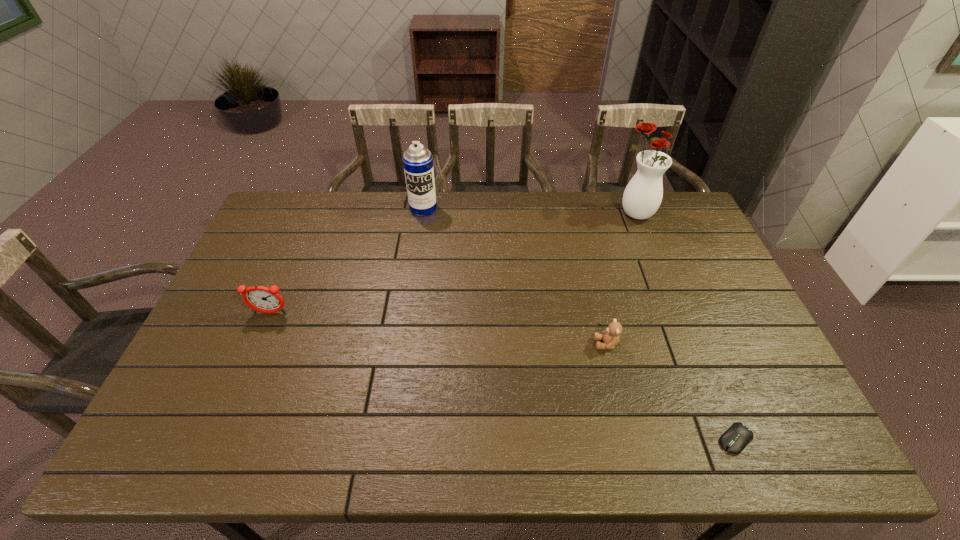
At what (x,y) coordinates should I click in order to perform the action: click on vacant space located on the label side of the fourth shortest object. Please return your answer as a coordinate pair (x, y). This screenshot has height=540, width=960. Looking at the image, I should click on (410, 299).

Where is `vacant space located 0.390m on the front-facing side of the leftmost object`? This screenshot has width=960, height=540. vacant space located 0.390m on the front-facing side of the leftmost object is located at coordinates (211, 452).

Where is `blank space located on the front-facing side of the teddy bear`? The height and width of the screenshot is (540, 960). blank space located on the front-facing side of the teddy bear is located at coordinates (458, 344).

Locate an element on the screen. free space located on the front-facing side of the teddy bear is located at coordinates (562, 344).

Locate an element on the screen. Image resolution: width=960 pixels, height=540 pixels. vacant space located 0.300m on the front-facing side of the teddy bear is located at coordinates (484, 344).

Locate an element on the screen. vacant area located 0.370m on the left of the shortest object is located at coordinates (557, 439).

Identify the location of vase that is positioned at the far edge. (642, 197).

The width and height of the screenshot is (960, 540). I want to click on aerosol can that is at the far edge, so click(x=418, y=162).

The image size is (960, 540). I want to click on object at the near edge, so click(x=736, y=438).

Where is `object positioned at the left edge`? This screenshot has height=540, width=960. object positioned at the left edge is located at coordinates (259, 298).